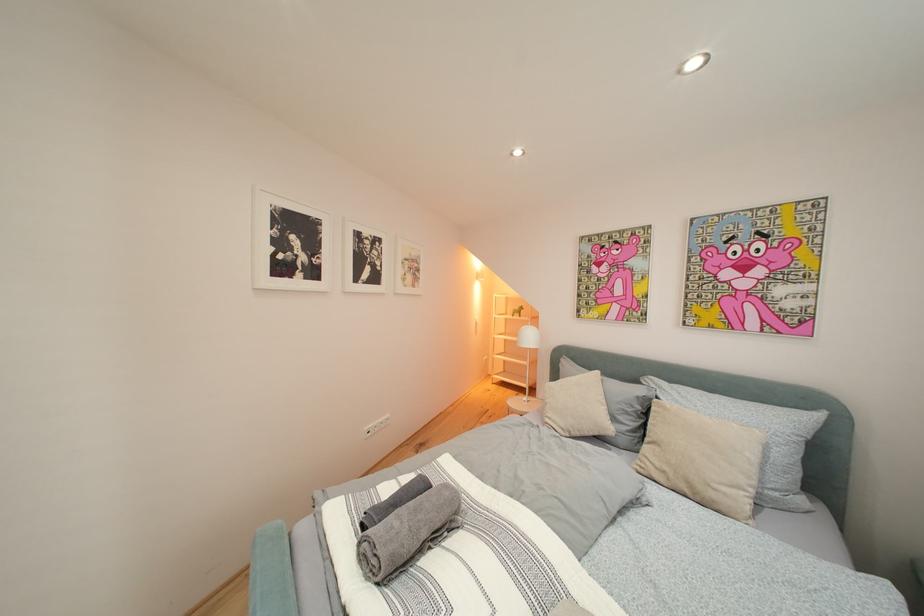
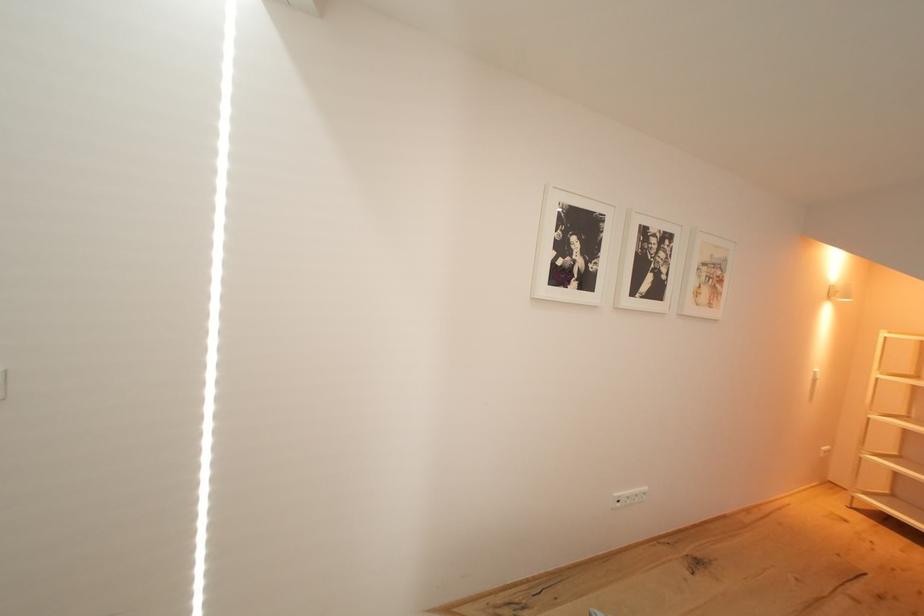
Question: The camera is either moving clockwise (left) or counter-clockwise (right) around the object. The first image is from the beginning of the video and the second image is from the end. Is the camera moving left or right when shooting the video?

Choices:
 (A) Left
 (B) Right

Answer: (B)